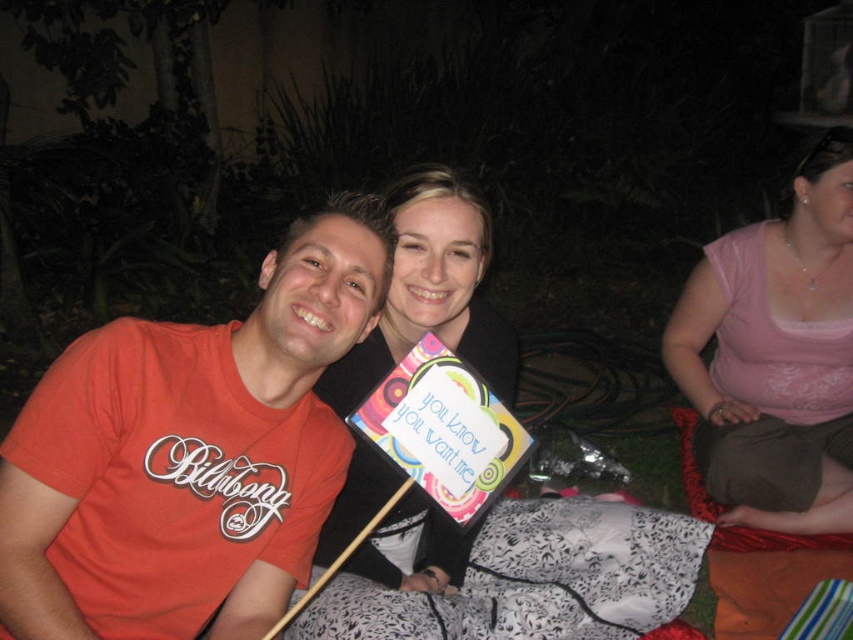
Question: Can you confirm if pink fabric at right is smaller than black printed fabric blanket at center?

Choices:
 (A) yes
 (B) no

Answer: (B)

Question: Which point is closer to the camera?

Choices:
 (A) (457, 612)
 (B) (74, 426)
 (C) (358, 452)
 (D) (795, 234)

Answer: (B)

Question: Which is nearer to the matte black sign at center?

Choices:
 (A) pink fabric at right
 (B) black printed fabric blanket at center
 (C) matte red t-shirt at left

Answer: (B)

Question: Considering the relative positions of pink fabric at right and matte black sign at center in the image provided, where is pink fabric at right located with respect to matte black sign at center?

Choices:
 (A) below
 (B) above

Answer: (B)

Question: Does black printed fabric blanket at center have a smaller size compared to matte black sign at center?

Choices:
 (A) yes
 (B) no

Answer: (A)

Question: Which point is closer to the camera?

Choices:
 (A) black printed fabric blanket at center
 (B) matte black sign at center
 (C) matte red t-shirt at left

Answer: (C)